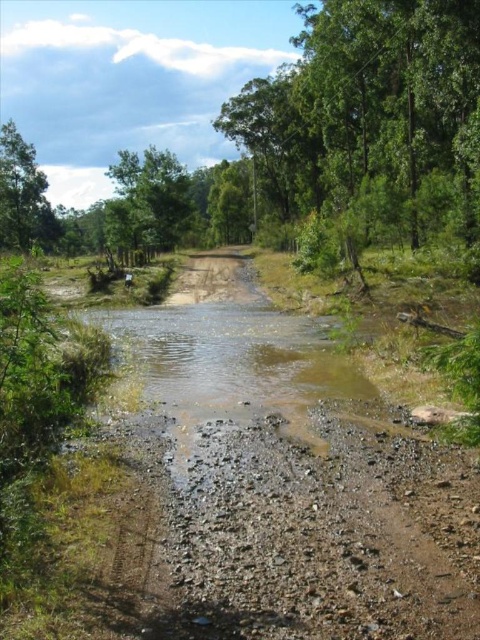
You are a hiker trying to cross the shallow stream on the dirt road. You notice two green leafy trees nearby. Which tree, the green leafy tree at center or the green leafy tree at upper left, is closer to the stream?

The green leafy tree at center is positioned under the green leafy tree at upper left, meaning it is closer to the stream.

You are a hiker trying to cross the shallow stream on the dirt road. You see the green leafy tree at center and the green leafy tree at upper left. Which tree would you choose to use as a landmark to navigate around the deepest part of the stream?

The green leafy tree at center might be wider than the green leafy tree at upper left, so it could be a better landmark to navigate around the deepest part of the stream since wider trees often indicate older, more established trees that might be near safer paths.